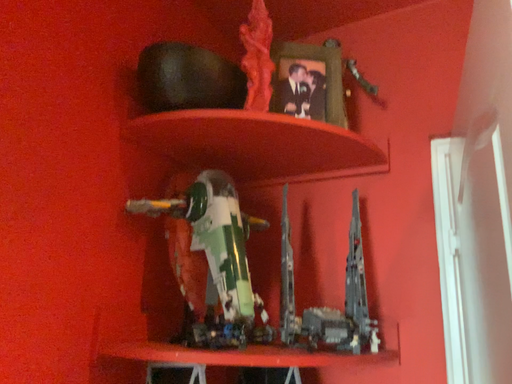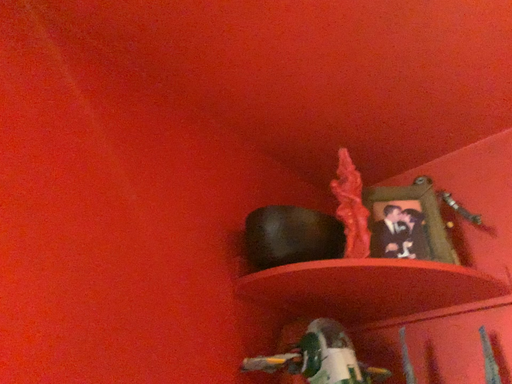
Question: Which way did the camera rotate in the video?

Choices:
 (A) rotated right
 (B) rotated left

Answer: (B)